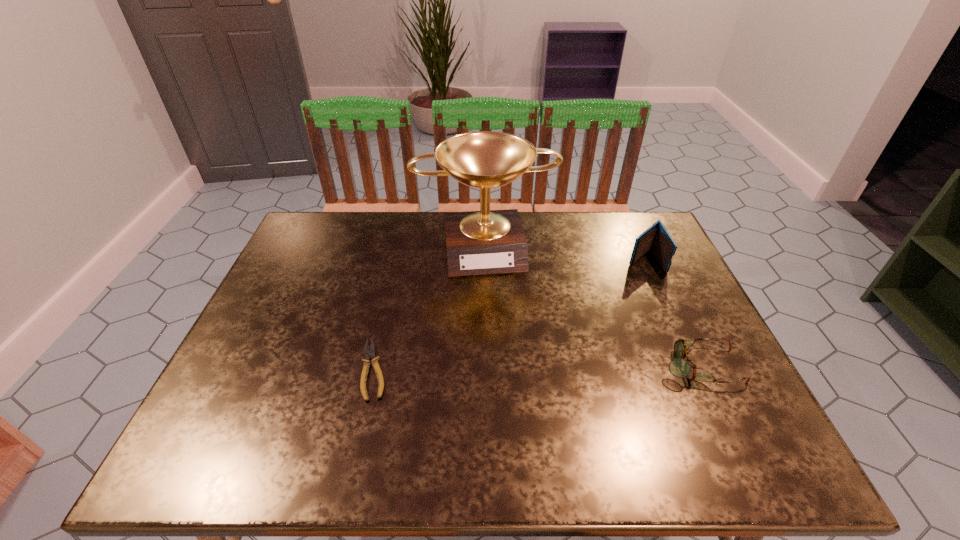
You are a GUI agent. You are given a task and a screenshot of the screen. Output one action in this format:
    pyautogui.click(x=<x>, y=<y>)
    Task: Click on the free space on the desktop that is between the shortest object and the third tallest object and is positioned on the exterior surface of the wallet
    
    Given the screenshot: What is the action you would take?
    pyautogui.click(x=513, y=368)

Find the location of a particular element. Image resolution: width=960 pixels, height=540 pixels. vacant spot on the desktop that is between the shortest object and the spectacles and is positioned on the front-facing side of the tallest object is located at coordinates (506, 368).